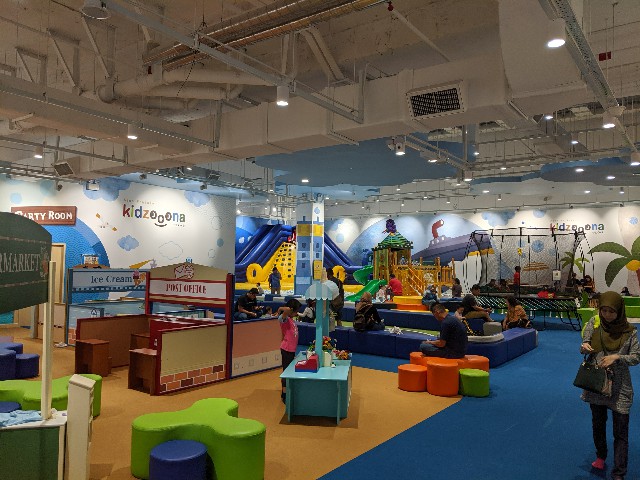
Identify the location of blue mats on floor. Image resolution: width=640 pixels, height=480 pixels. (559, 423).